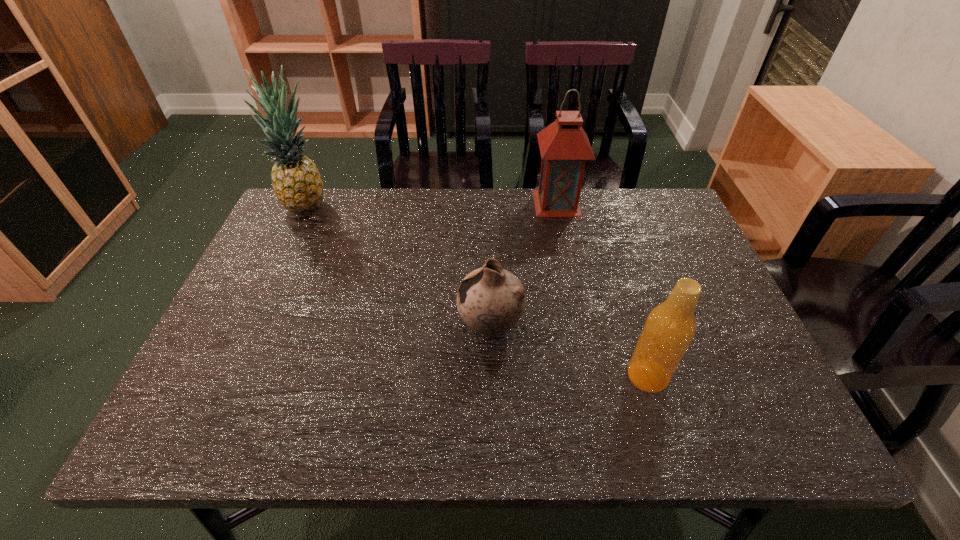
The width and height of the screenshot is (960, 540). In order to click on free space located 0.210m from the spout of the shortest object in this screenshot , I will do `click(367, 326)`.

Identify the location of free spot located from the spout of the shortest object. (406, 326).

At what (x,y) coordinates should I click in order to perform the action: click on pineapple that is at the far edge. Please return your answer as a coordinate pair (x, y). This screenshot has width=960, height=540. Looking at the image, I should click on (297, 184).

Where is `lantern that is at the far edge`? Image resolution: width=960 pixels, height=540 pixels. lantern that is at the far edge is located at coordinates (564, 146).

Where is `object present at the left edge`? This screenshot has height=540, width=960. object present at the left edge is located at coordinates (297, 184).

Where is `object that is at the far left corner`? object that is at the far left corner is located at coordinates (297, 184).

The height and width of the screenshot is (540, 960). In the image, there is a desktop. In order to click on vacant space at the far edge in this screenshot , I will do `click(476, 216)`.

Where is `free space at the near edge of the desktop`? This screenshot has height=540, width=960. free space at the near edge of the desktop is located at coordinates (474, 442).

Locate an element on the screen. The width and height of the screenshot is (960, 540). vacant space at the right edge of the desktop is located at coordinates (732, 352).

In the image, there is a desktop. At what (x,y) coordinates should I click in order to perform the action: click on blank space at the far right corner. Please return your answer as a coordinate pair (x, y). Looking at the image, I should click on (663, 219).